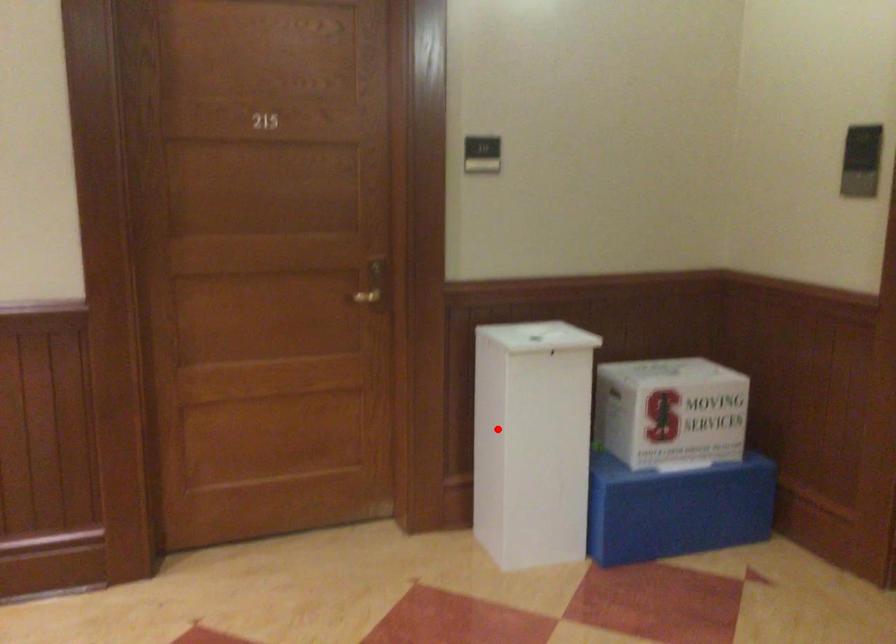
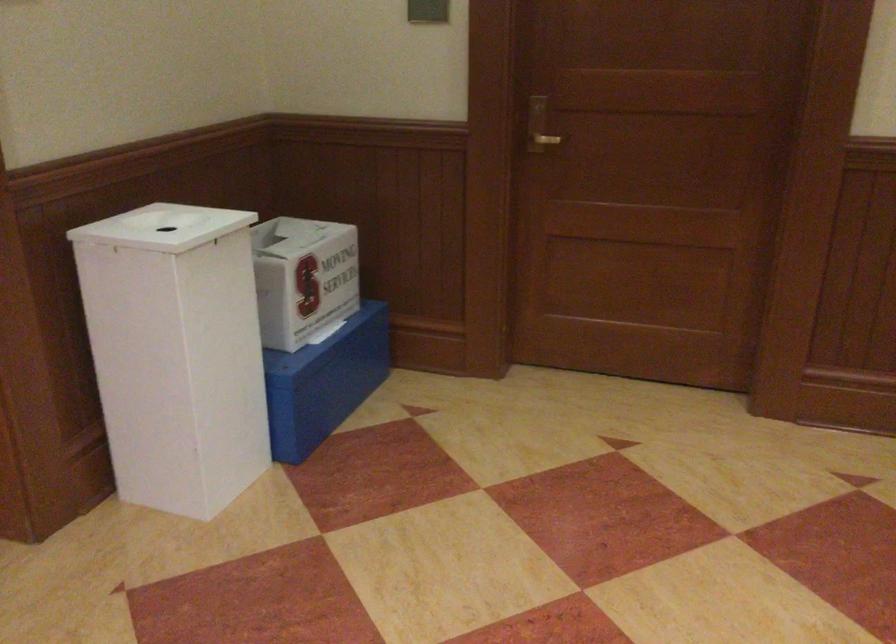
Question: I am providing you with two images of the same scene from different viewpoints. Image1 has a red point marked. In image2, the corresponding 3D location appears at what relative position? Reply with the corresponding letter.

Choices:
 (A) Closer
 (B) Farther

Answer: (A)